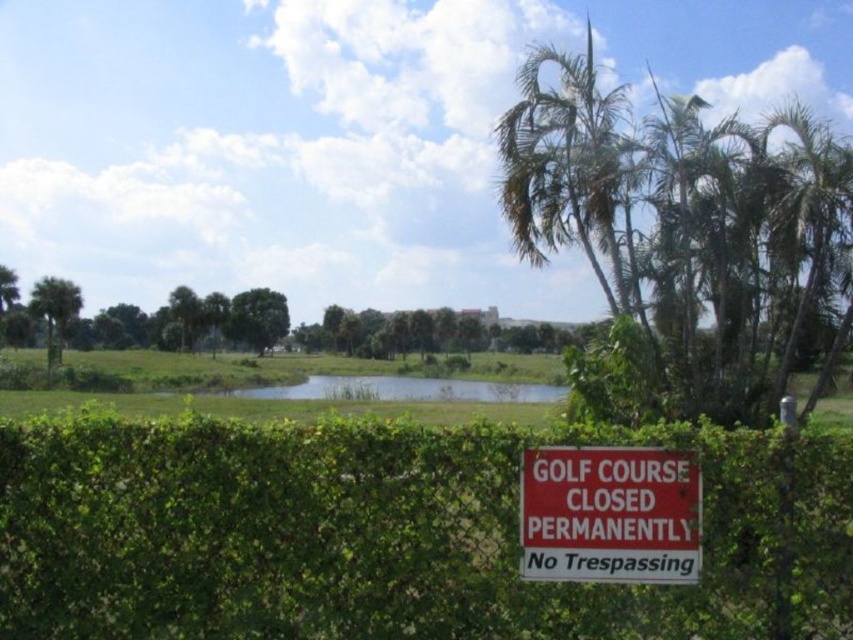
Consider the image. Is green grassy flood at center further to the viewer compared to green leafy palm tree at left?

No, green grassy flood at center is in front of green leafy palm tree at left.

From the picture: Is green grassy flood at center thinner than green leafy palm tree at left?

In fact, green grassy flood at center might be wider than green leafy palm tree at left.

Is point (299, 385) closer to camera compared to point (57, 330)?

That is False.

Image resolution: width=853 pixels, height=640 pixels. Find the location of `green grassy flood at center`. green grassy flood at center is located at coordinates (407, 388).

Is red matte sign at lower center above green grassy flood at center?

Yes.

Is red matte sign at lower center to the right of green grassy flood at center from the viewer's perspective?

Yes, red matte sign at lower center is to the right of green grassy flood at center.

Which is behind, point (654, 515) or point (532, 396)?

The point (532, 396) is behind.

The width and height of the screenshot is (853, 640). Find the location of `red matte sign at lower center`. red matte sign at lower center is located at coordinates (608, 515).

Which of these two, green grassy flood at center or green leafy tree at center, stands taller?

Standing taller between the two is green leafy tree at center.

Is point (413, 385) positioned after point (248, 346)?

No.

Between point (265, 387) and point (262, 296), which one is positioned in front?

Point (265, 387) is in front.

This screenshot has height=640, width=853. In order to click on green grassy flood at center in this screenshot , I will do `click(407, 388)`.